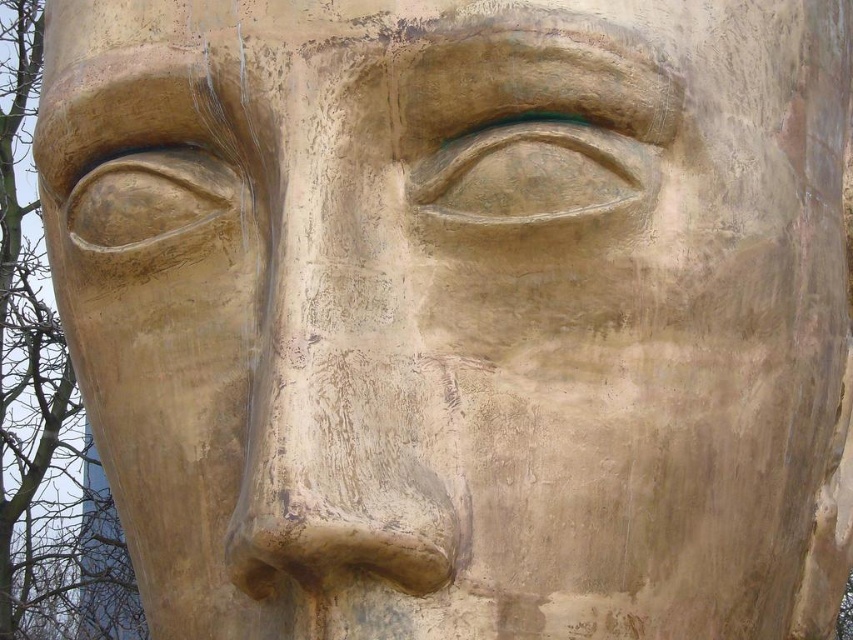
You are an art conservator standing 2 meters away from the sculpture. The sculpture has a matte gold nose at center. Can you reach the nose with a 1.5 meter long conservation tool?

The matte gold nose at center is 2.11 meters from viewer. Since the conservator is standing 2 meters away and the tool is 1.5 meters long, the total reach would be 3.5 meters. This exceeds the distance to the nose, so yes, the conservator can reach it.

You are standing 5 feet away from the sculpture. Can you reach the point at coordinates point (x=322, y=502) on the sculpture with your hand?

The distance of point (x=322, y=502) from viewer is 7.02 feet, so you are 2.02 feet away from the point. Since the sculpture is 7.02 feet away from you, and you are standing 5 feet away from it, the total distance between you and the point is 7.02 feet. Therefore, you cannot reach the point with your hand as it is farther than your arm length.

You are an art conservator examining the sculpture. You notice the matte gold nose at center and the matte gold eye at center. Which of these two features is positioned to the right side of the sculpture?

The matte gold eye at center is positioned to the right side of the sculpture because the matte gold nose at center is to the left of it.